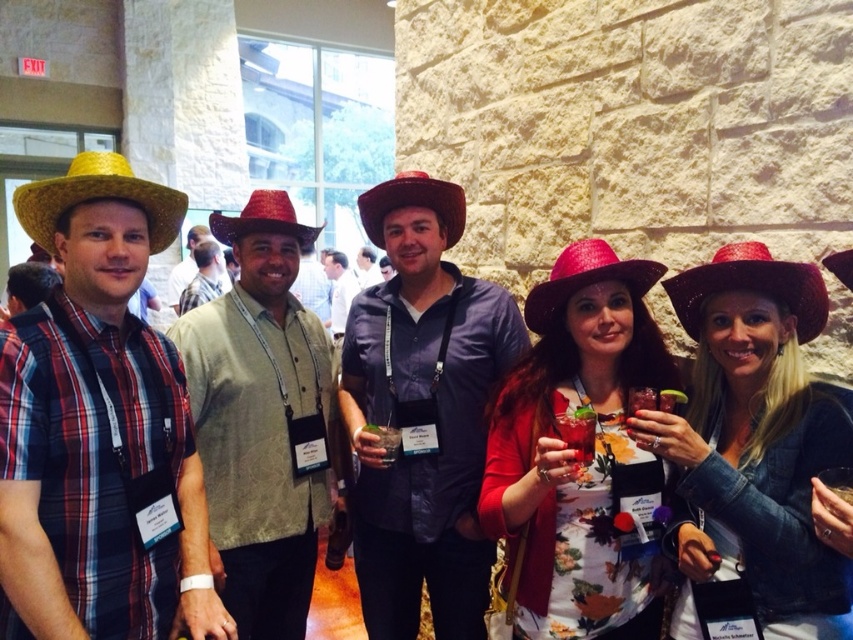
You are a photographer at the event and want to ensure all hats are visible in the photo. Since the matte brown cowboy hat at center and the sparkly red cowboy hat at center are overlapping, which hat is covering the other?

The matte brown cowboy hat at center is positioned over the sparkly red cowboy hat at center, so it is covering the sparkly red one.

You are organizing a hat display for an event and need to arrange the matte brown cowboy hat at center and the sparkly red cowboy hat at center. According to the image, which hat should you place on the top shelf if you want the larger one to be more visible?

The matte brown cowboy hat at center is larger in size than the sparkly red cowboy hat at center, so place the matte brown cowboy hat at center on the top shelf to make it more visible.

You are a photographer trying to capture the sparkly red cowboy hat at center and the matte straw cowboy hat at center in a single shot. Which hat should you adjust your camera angle to focus on first if you want to include both hats in the frame?

The sparkly red cowboy hat at center is above the matte straw cowboy hat at center, so you should focus on the sparkly red cowboy hat at center first to ensure both hats are captured in the frame.